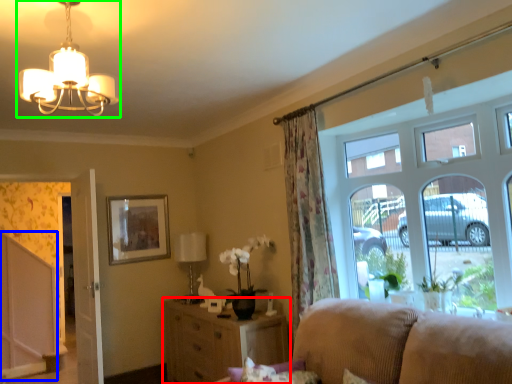
Question: Which is nearer to the cabinetry (highlighted by a red box)? screen door (highlighted by a blue box) or lamp (highlighted by a green box).

Choices:
 (A) screen door
 (B) lamp

Answer: (A)